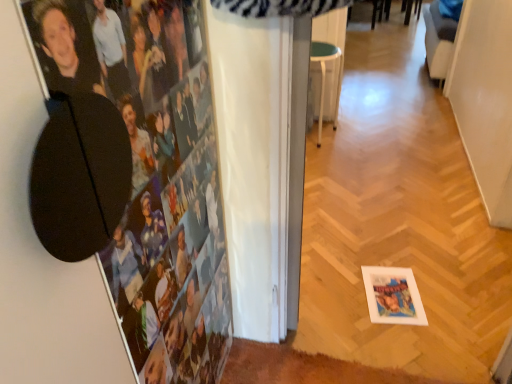
Describe the element at coordinates (438, 41) in the screenshot. Image resolution: width=512 pixels, height=384 pixels. I see `fabric swivel chair at upper right` at that location.

Measure the distance between point (71, 18) and camera.

The distance of point (71, 18) from camera is 18.43 inches.

This screenshot has height=384, width=512. Describe the element at coordinates (153, 172) in the screenshot. I see `black matte photo frame at upper left` at that location.

Find the location of a particular element. This screenshot has height=384, width=512. fabric swivel chair at upper right is located at coordinates (438, 41).

Which of these two, white plastic stool at center or black matte photo frame at upper left, stands shorter?

With less height is white plastic stool at center.

Looking at the image, does white plastic stool at center seem bigger or smaller compared to black matte photo frame at upper left?

Clearly, white plastic stool at center is larger in size than black matte photo frame at upper left.

Can you tell me how much white plastic stool at center and black matte photo frame at upper left differ in facing direction?

They differ by 88.7 degrees in their facing directions.

Considering the relative sizes of white plastic stool at center and black matte photo frame at upper left in the image provided, is white plastic stool at center thinner than black matte photo frame at upper left?

No.

Is fabric swivel chair at upper right looking in the opposite direction of white plastic stool at center?

fabric swivel chair at upper right is not turned away from white plastic stool at center.

Which of these two, fabric swivel chair at upper right or white plastic stool at center, is bigger?

Bigger between the two is fabric swivel chair at upper right.

Who is more distant, fabric swivel chair at upper right or white plastic stool at center?

fabric swivel chair at upper right is more distant.

What are the coordinates of `person on the left of fabric swivel chair at upper right` in the screenshot? It's located at (153, 172).

Is there a large distance between fabric swivel chair at upper right and black matte photo frame at upper left?

fabric swivel chair at upper right is far away from black matte photo frame at upper left.

Measure the distance between fabric swivel chair at upper right and black matte photo frame at upper left.

fabric swivel chair at upper right is 3.14 meters from black matte photo frame at upper left.

Is fabric swivel chair at upper right further to camera compared to black matte photo frame at upper left?

Yes, it is behind black matte photo frame at upper left.

Is white plastic stool at center wider than fabric swivel chair at upper right?

Correct, the width of white plastic stool at center exceeds that of fabric swivel chair at upper right.

Could you tell me if white plastic stool at center is facing fabric swivel chair at upper right?

No, white plastic stool at center is not oriented towards fabric swivel chair at upper right.

Locate an element on the screen. The width and height of the screenshot is (512, 384). swivel chair that is behind the white plastic stool at center is located at coordinates (438, 41).

From a real-world perspective, which object stands above the other?

fabric swivel chair at upper right, from a real-world perspective.

Can you tell me how much black matte photo frame at upper left and white plastic stool at center differ in facing direction?

There is a 88.7-degree angle between the facing directions of black matte photo frame at upper left and white plastic stool at center.

Which of these two, black matte photo frame at upper left or white plastic stool at center, stands shorter?

With less height is white plastic stool at center.

Find the location of `person on the left of white plastic stool at center`. person on the left of white plastic stool at center is located at coordinates (153, 172).

From the image's perspective, between black matte photo frame at upper left and white plastic stool at center, who is located below?

black matte photo frame at upper left appears lower in the image.

Is there a large distance between black matte photo frame at upper left and fabric swivel chair at upper right?

Yes.

Considering the positions of point (153, 284) and point (448, 53), is point (153, 284) closer or farther from the camera than point (448, 53)?

Point (153, 284) appears to be closer to the viewer than point (448, 53).

From the image's perspective, is black matte photo frame at upper left on top of fabric swivel chair at upper right?

No, from the image's perspective, black matte photo frame at upper left is not on top of fabric swivel chair at upper right.

Looking at this image, which object is closer to the camera, black matte photo frame at upper left or fabric swivel chair at upper right?

black matte photo frame at upper left is in front.

This screenshot has width=512, height=384. I want to click on person on the left of white plastic stool at center, so click(x=153, y=172).

Where is `swivel chair behind the white plastic stool at center`? This screenshot has height=384, width=512. swivel chair behind the white plastic stool at center is located at coordinates [x=438, y=41].

Looking at the image, which one is located further to fabric swivel chair at upper right, black matte photo frame at upper left or white plastic stool at center?

black matte photo frame at upper left is further to fabric swivel chair at upper right.

Estimate the real-world distances between objects in this image. Which object is further from white plastic stool at center, black matte photo frame at upper left or fabric swivel chair at upper right?

black matte photo frame at upper left lies further to white plastic stool at center than the other object.

Considering their positions, is white plastic stool at center positioned closer to black matte photo frame at upper left than fabric swivel chair at upper right?

white plastic stool at center is closer to black matte photo frame at upper left.

Looking at the image, which one is located further to white plastic stool at center, fabric swivel chair at upper right or black matte photo frame at upper left?

Based on the image, black matte photo frame at upper left appears to be further to white plastic stool at center.

Which object lies nearer to the anchor point black matte photo frame at upper left, fabric swivel chair at upper right or white plastic stool at center?

The object closer to black matte photo frame at upper left is white plastic stool at center.

Considering their positions, is white plastic stool at center positioned closer to fabric swivel chair at upper right than black matte photo frame at upper left?

white plastic stool at center is closer to fabric swivel chair at upper right.

Find the location of a particular element. Image resolution: width=512 pixels, height=384 pixels. furniture located between black matte photo frame at upper left and fabric swivel chair at upper right in the depth direction is located at coordinates (323, 71).